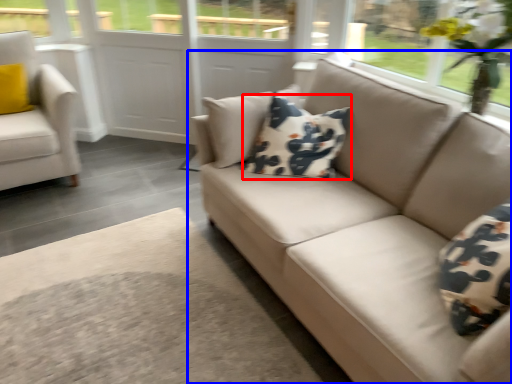
Question: Which object appears closest to the camera in this image, pillow (highlighted by a red box) or studio couch (highlighted by a blue box)?

Choices:
 (A) pillow
 (B) studio couch

Answer: (B)